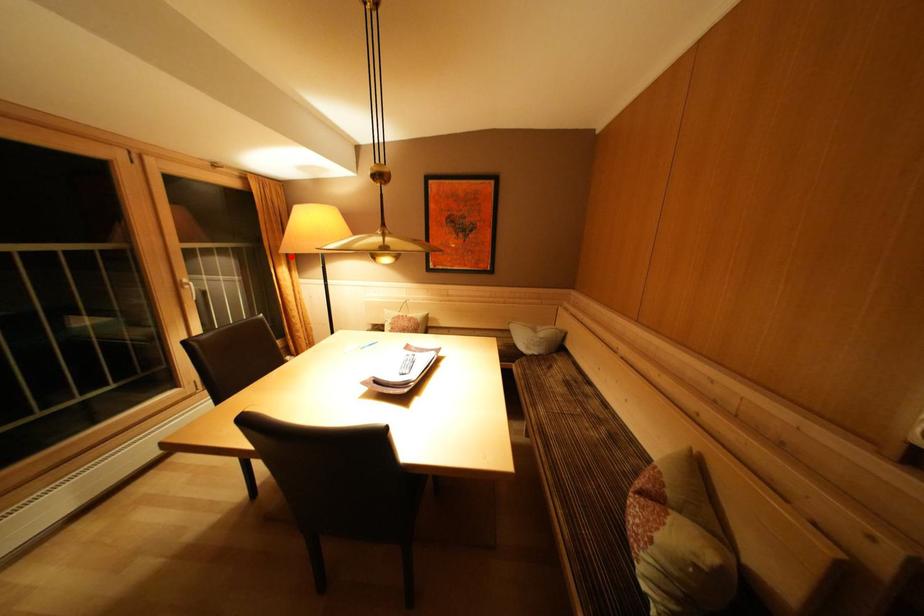
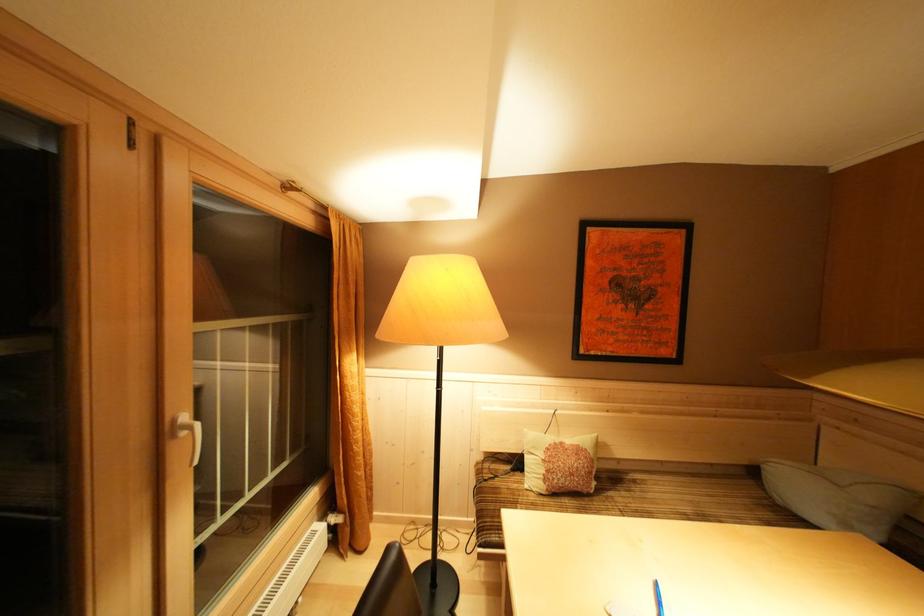
Find the pixel in the second image that matches the highlighted location in the first image.

(385, 339)